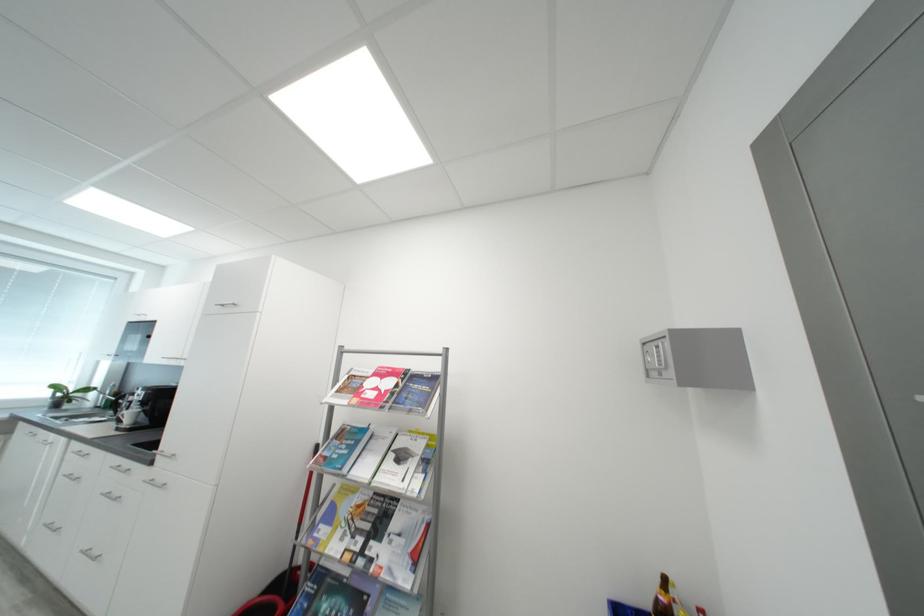
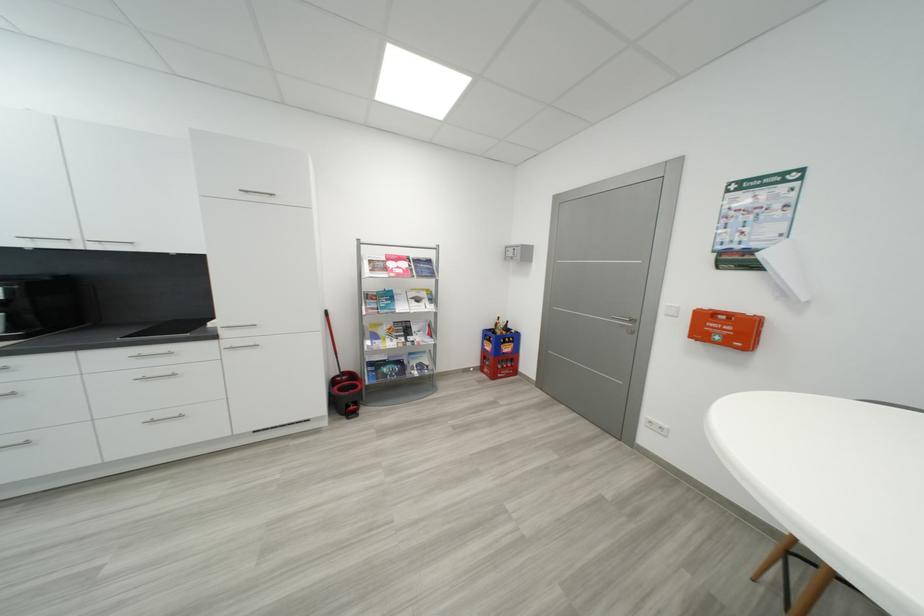
The point at (177, 454) is marked in the first image. Where is the corresponding point in the second image?

(256, 325)